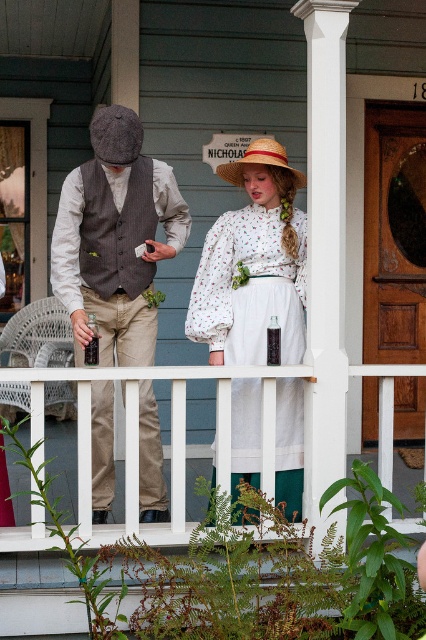
Between floral cotton blouse at center and white wooden railing at center, which one has less height?

white wooden railing at center is shorter.

Between floral cotton blouse at center and white wooden railing at center, which one is positioned higher?

floral cotton blouse at center

Does point (281, 285) lie behind point (83, 429)?

Yes.

The height and width of the screenshot is (640, 426). I want to click on floral cotton blouse at center, so click(x=253, y=264).

Image resolution: width=426 pixels, height=640 pixels. What do you see at coordinates (115, 240) in the screenshot?
I see `matte brown vest at left` at bounding box center [115, 240].

Between matte brown vest at left and white wooden railing at center, which one appears on the right side from the viewer's perspective?

white wooden railing at center is more to the right.

Find the location of a particular element. matte brown vest at left is located at coordinates (115, 240).

Who is taller, floral cotton blouse at center or strawmaterial/texturehat at upper center?

floral cotton blouse at center is taller.

Is floral cotton blouse at center wider than strawmaterial/texturehat at upper center?

Yes, floral cotton blouse at center is wider than strawmaterial/texturehat at upper center.

Who is more forward, (244, 332) or (253, 141)?

Point (244, 332) is in front.

Find the location of a particular element. floral cotton blouse at center is located at coordinates (253, 264).